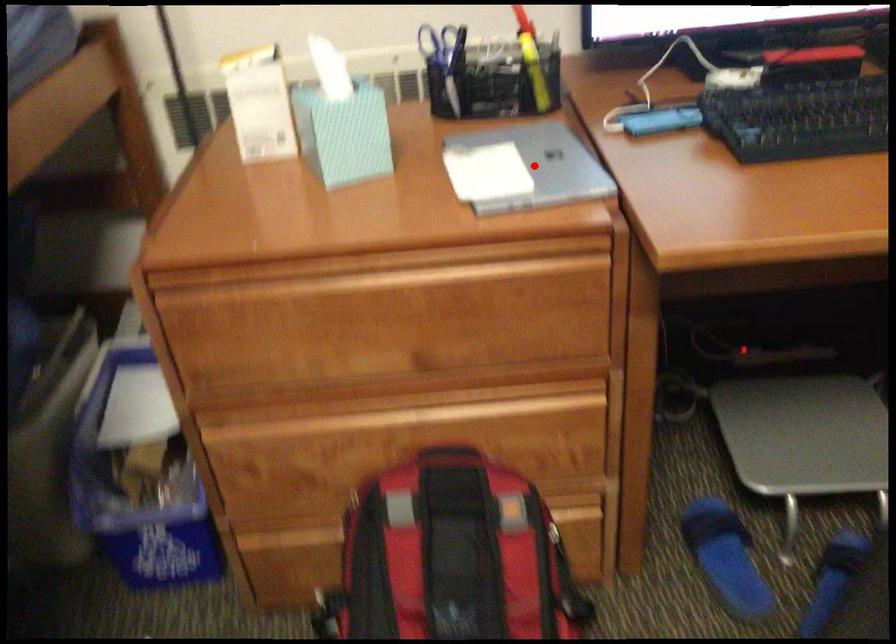
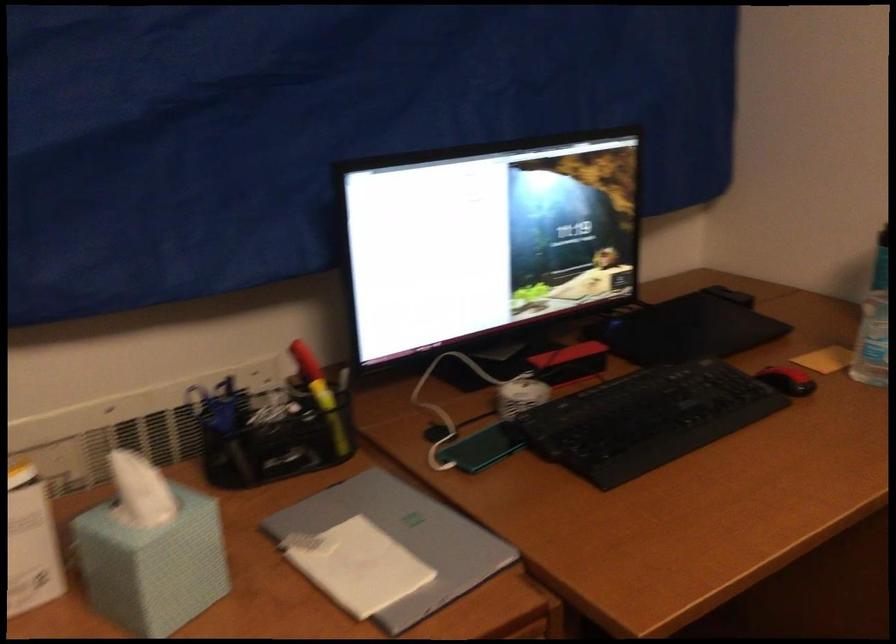
Question: I am providing you with two images of the same scene from different viewpoints. Image1 has a red point marked. In image2, the corresponding 3D location appears at what relative position? Reply with the corresponding letter.

Choices:
 (A) Closer
 (B) Farther

Answer: (A)